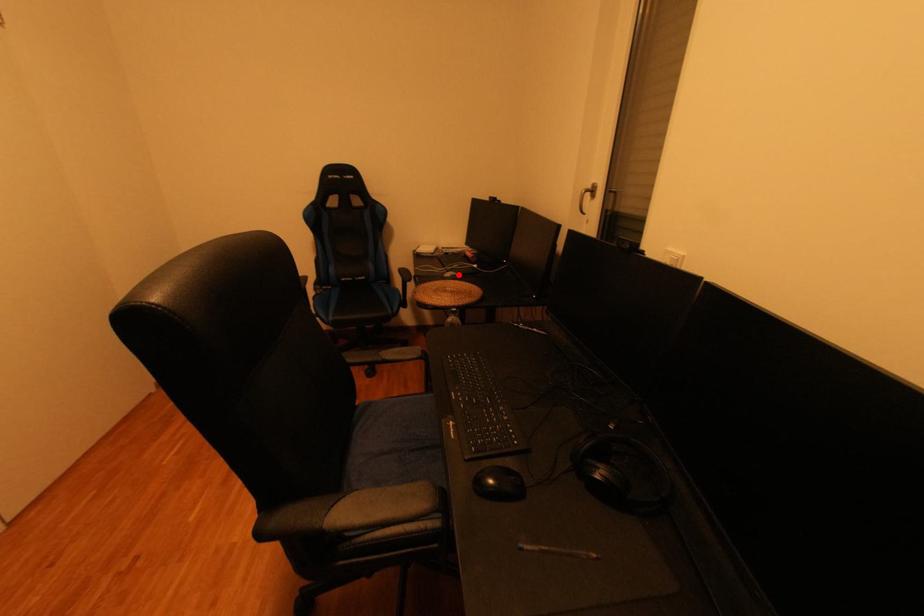
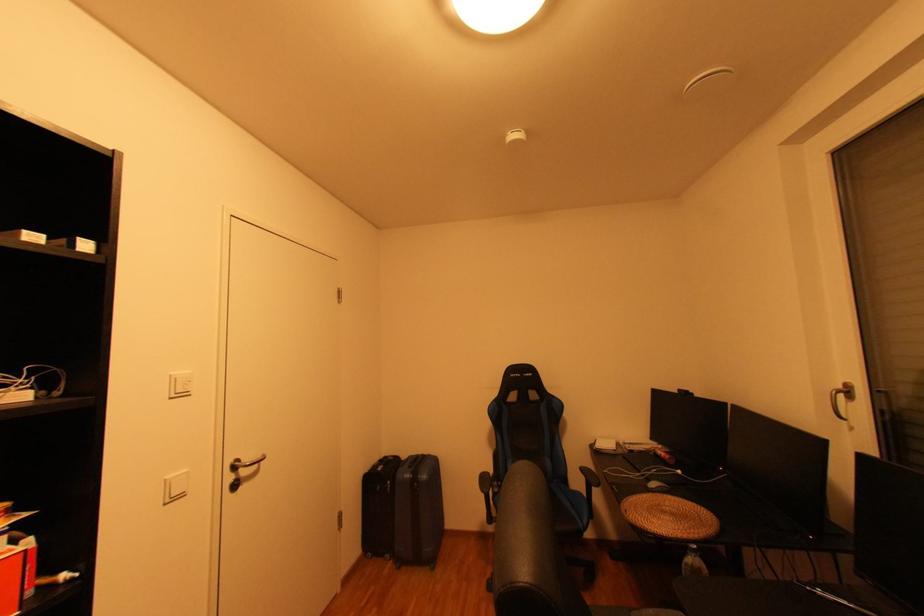
In the second image, find the point that corresponds to the highlighted location in the first image.

(663, 485)